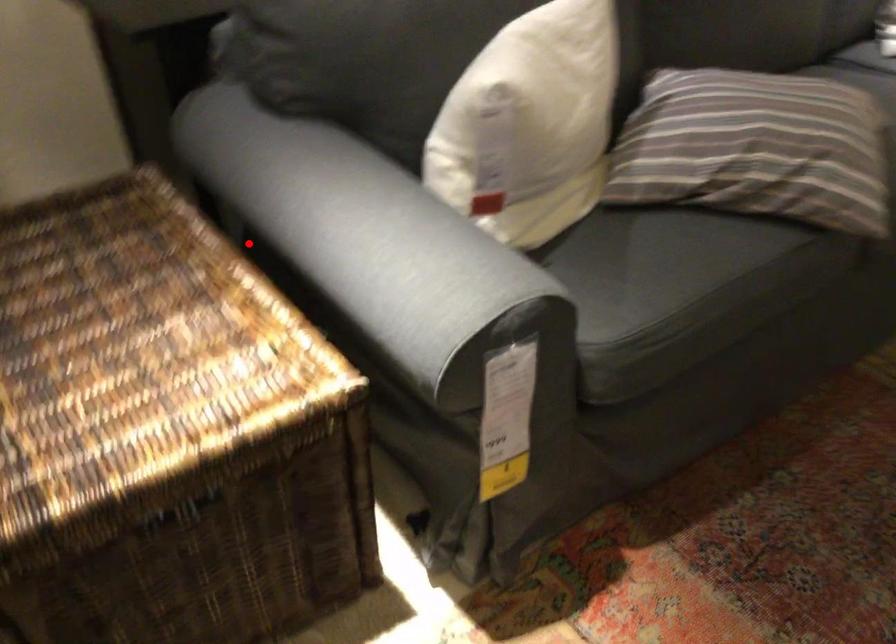
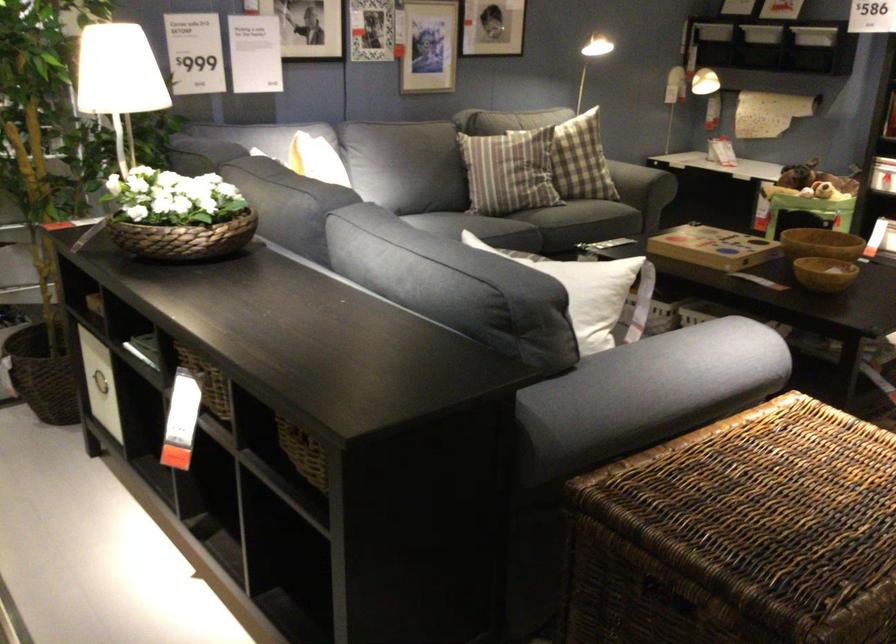
The point at the highlighted location is marked in the first image. Where is the corresponding point in the second image?

(647, 393)